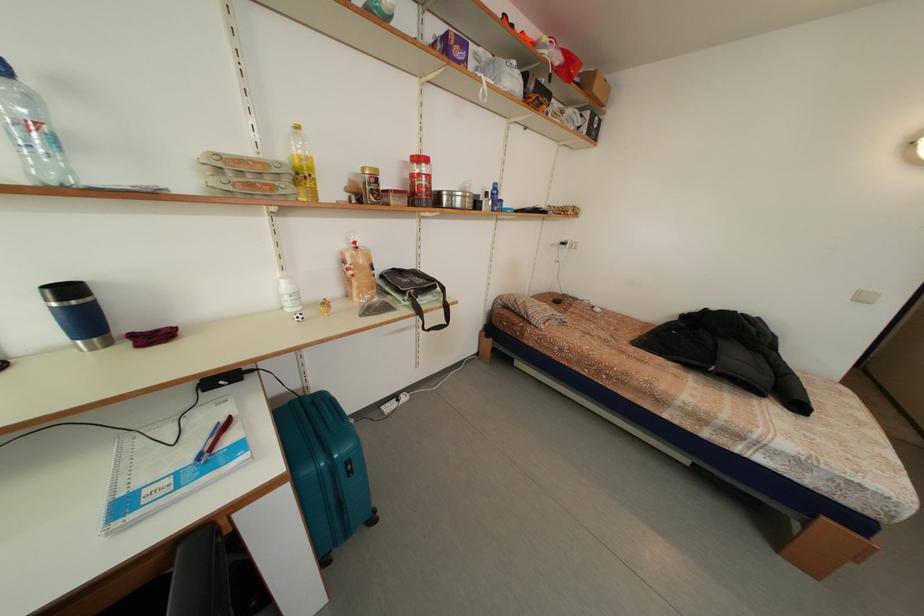
Locate an element on the screen. Image resolution: width=924 pixels, height=616 pixels. red pen is located at coordinates (220, 435).